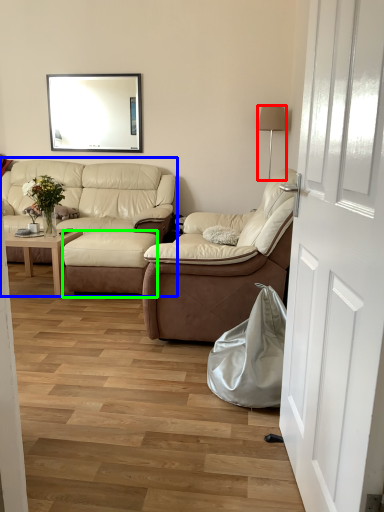
Question: Based on their relative distances, which object is nearer to lamp (highlighted by a red box)? Choose from studio couch (highlighted by a blue box) and footrest (highlighted by a green box).

Choices:
 (A) studio couch
 (B) footrest

Answer: (A)